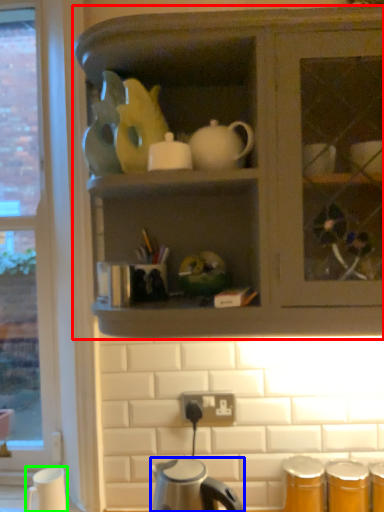
Question: Which object is the closest to the cabinetry (highlighted by a red box)? Choose among these: kettle (highlighted by a blue box) or coffee cup (highlighted by a green box).

Choices:
 (A) kettle
 (B) coffee cup

Answer: (A)